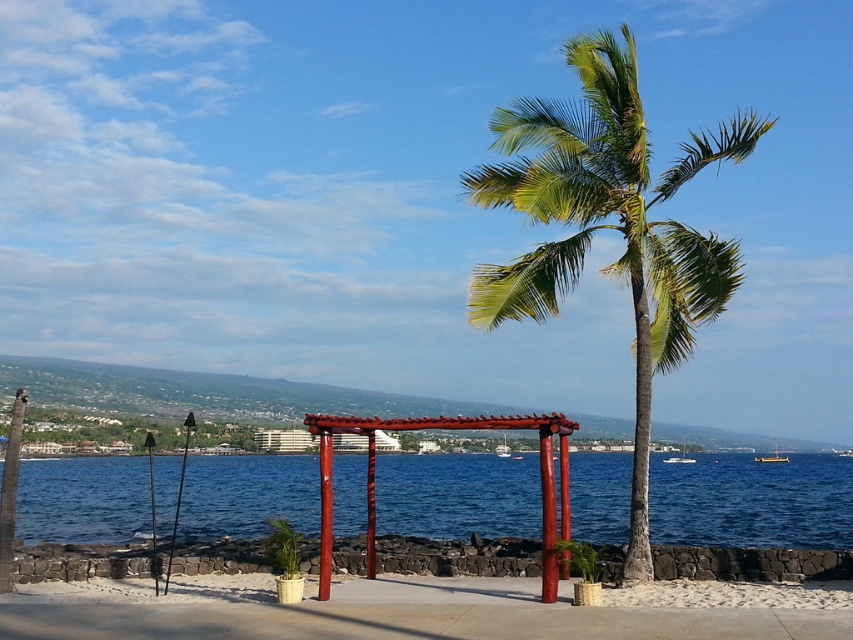
Question: Does blue water at center have a smaller size compared to white sand at lower center?

Choices:
 (A) no
 (B) yes

Answer: (A)

Question: Among these objects, which one is nearest to the camera?

Choices:
 (A) blue water at center
 (B) white sand at lower center
 (C) green leafy palm tree at center

Answer: (B)

Question: Is blue water at center closer to the viewer compared to green leafy palm tree at center?

Choices:
 (A) no
 (B) yes

Answer: (B)

Question: Which point is farther to the camera?

Choices:
 (A) (698, 291)
 (B) (376, 605)
 (C) (769, 541)

Answer: (C)

Question: Considering the relative positions of blue water at center and green leafy palm tree at center in the image provided, where is blue water at center located with respect to green leafy palm tree at center?

Choices:
 (A) below
 (B) above

Answer: (A)

Question: Which is nearer to the white sand at lower center?

Choices:
 (A) green leafy palm tree at center
 (B) blue water at center

Answer: (A)